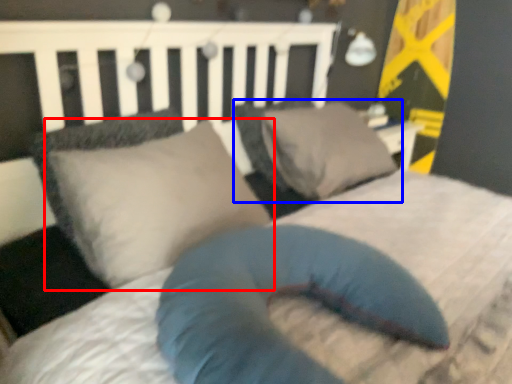
Question: Among these objects, which one is farthest to the camera, pillow (highlighted by a red box) or pillow (highlighted by a blue box)?

Choices:
 (A) pillow
 (B) pillow

Answer: (B)